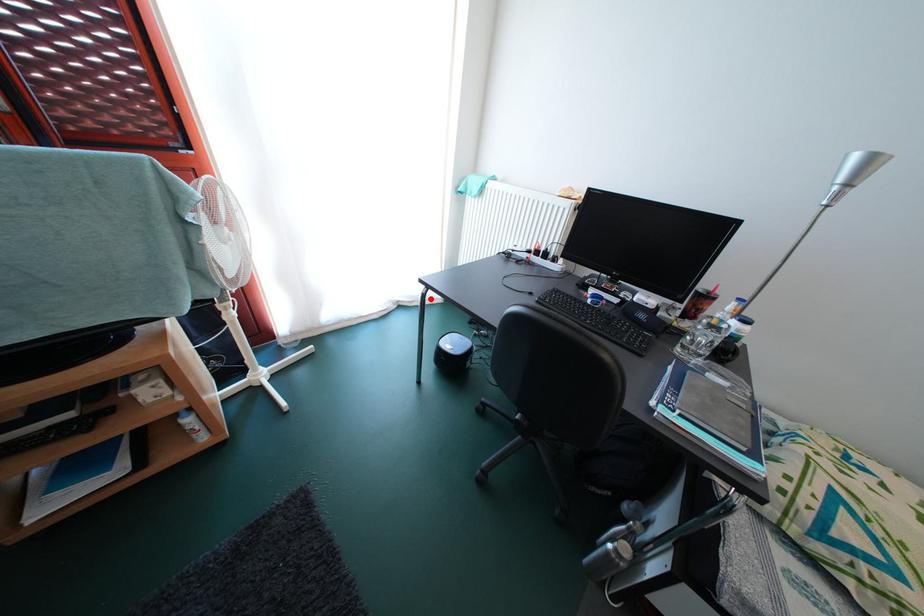
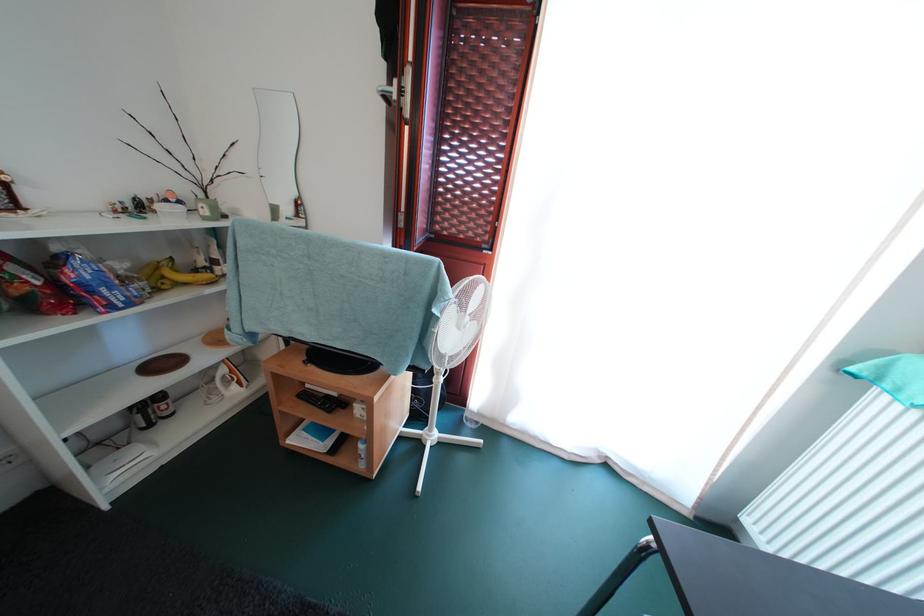
Find the pixel in the second image that matches the highlighted location in the first image.

(655, 551)